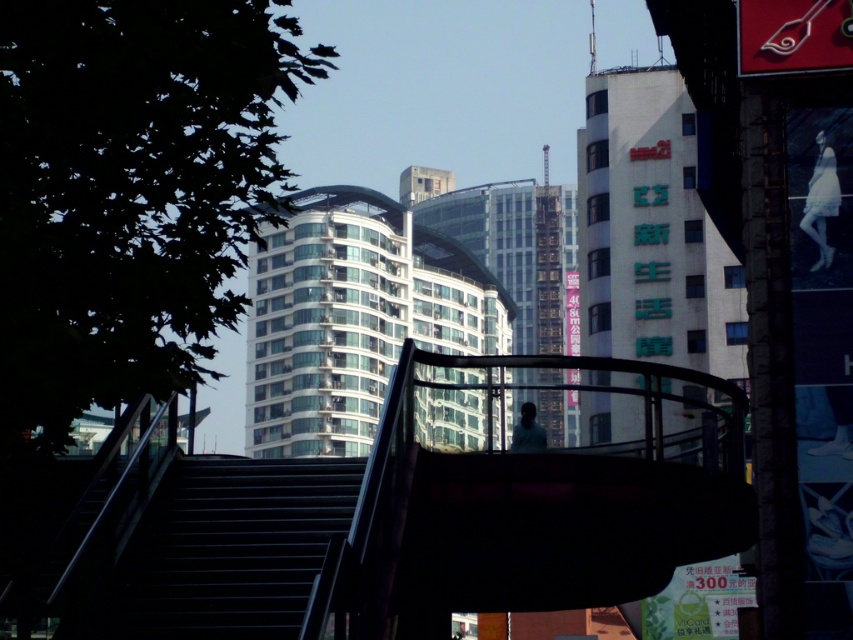
Question: Is black metal stairs at center to the right of white lace dress at upper right from the viewer's perspective?

Choices:
 (A) yes
 (B) no

Answer: (B)

Question: Does black metal stairs at center lie behind white lace dress at upper right?

Choices:
 (A) yes
 (B) no

Answer: (B)

Question: Which object is positioned closest to the light blue fabric person at center?

Choices:
 (A) white lace dress at upper right
 (B) black metal stairs at center

Answer: (B)

Question: Is black metal stairs at center smaller than white lace dress at upper right?

Choices:
 (A) yes
 (B) no

Answer: (B)

Question: Which object is farther from the camera taking this photo?

Choices:
 (A) black metal stairs at center
 (B) white lace dress at upper right

Answer: (B)

Question: Estimate the real-world distances between objects in this image. Which object is closer to the white lace dress at upper right?

Choices:
 (A) light blue fabric person at center
 (B) black metal stairs at center

Answer: (A)